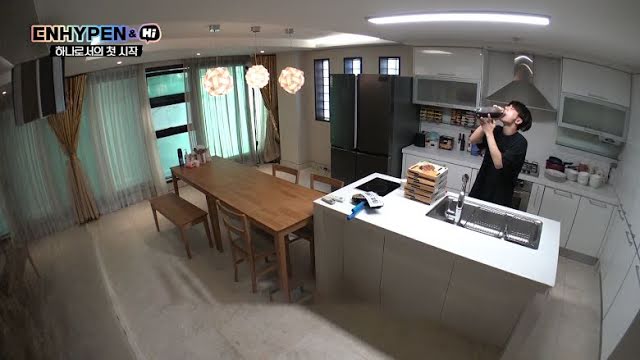
You are a GUI agent. You are given a task and a screenshot of the screen. Output one action in this format:
    pyautogui.click(x=<x>, y=<y>)
    Task: Click on the counter
    The height and width of the screenshot is (360, 640).
    Given the screenshot: What is the action you would take?
    pyautogui.click(x=444, y=247)